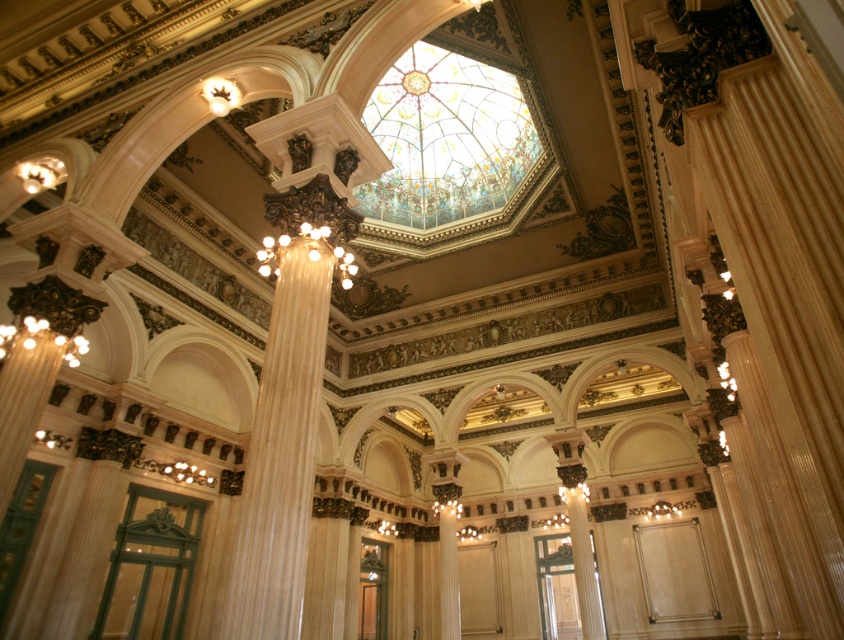
Between point (311, 422) and point (458, 628), which one is positioned in front?

Point (311, 422) is in front.

Who is positioned more to the left, white glossy column at center or white marble pillar at center?

white glossy column at center

Is point (277, 332) closer to camera compared to point (446, 513)?

That is True.

Where is `white glossy column at center`? This screenshot has height=640, width=844. white glossy column at center is located at coordinates (279, 458).

Looking at this image, can you confirm if white glossy column at center is thinner than matte gold chandelier at center?

Yes.

Which of these two, white glossy column at center or matte gold chandelier at center, stands taller?

With more height is white glossy column at center.

Does point (307, 400) lie behind point (301, 234)?

No, it is not.

The image size is (844, 640). What are the coordinates of `white glossy column at center` in the screenshot? It's located at (279, 458).

Between point (506, 44) and point (312, 225), which one is positioned behind?

Positioned behind is point (506, 44).

Who is more forward, (425, 128) or (307, 224)?

Point (307, 224) is in front.

What do you see at coordinates (452, 141) in the screenshot?
I see `stained glass dome at center` at bounding box center [452, 141].

The width and height of the screenshot is (844, 640). I want to click on stained glass dome at center, so click(452, 141).